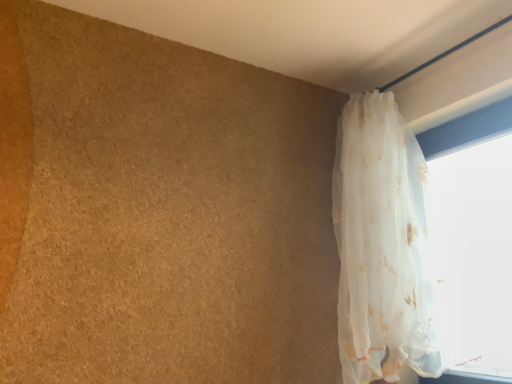
Identify the location of translucent white curtain at upper right. This screenshot has height=384, width=512. (382, 245).

What do you see at coordinates (382, 245) in the screenshot?
I see `translucent white curtain at upper right` at bounding box center [382, 245].

Find the location of `translucent white curtain at upper right`. translucent white curtain at upper right is located at coordinates (382, 245).